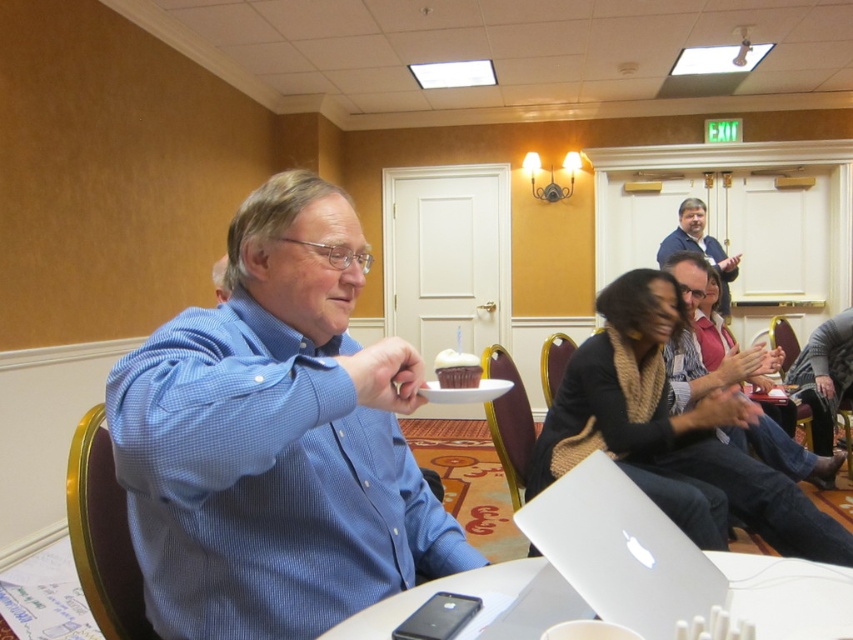
Question: Is knitted scarf at center positioned before blue shirt at center?

Choices:
 (A) yes
 (B) no

Answer: (A)

Question: Can you confirm if knitted scarf at center is positioned to the right of blue shirt at center?

Choices:
 (A) yes
 (B) no

Answer: (B)

Question: Based on their relative distances, which object is nearer to the blue shirt at center?

Choices:
 (A) smooth beige scarf at center
 (B) white matte laptop at lower center

Answer: (A)

Question: Among these objects, which one is farthest from the camera?

Choices:
 (A) blue shirt at center
 (B) knitted scarf at center
 (C) smooth beige scarf at center
 (D) white matte laptop at lower center

Answer: (A)

Question: Does white plastic table at center have a greater width compared to smooth beige scarf at center?

Choices:
 (A) yes
 (B) no

Answer: (B)

Question: Which is nearer to the white matte laptop at lower center?

Choices:
 (A) smooth beige scarf at center
 (B) blue checkered shirt at center
 (C) knitted scarf at center

Answer: (B)